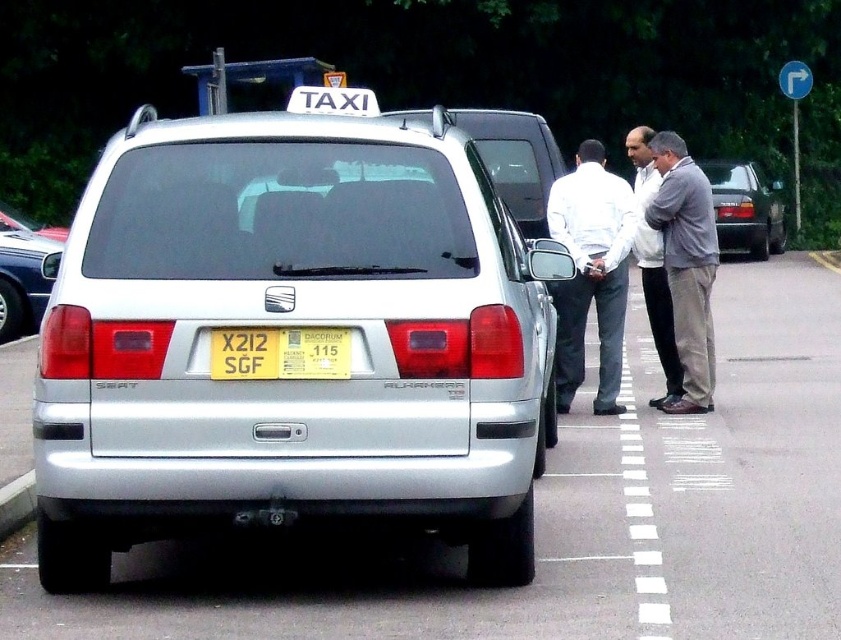
You are a photographer taking a photo of two men in shirts. You notice the white smooth shirt at center and the light gray shirt at center. Which shirt should you focus on to capture more details due to its size?

The white smooth shirt at center is larger in width than the light gray shirt at center, so focusing on the white smooth shirt at center would allow you to capture more details due to its size.

You are a delivery person who needs to hand over a package to the person wearing the gray suit at center. The package is currently on the yellow paper at center. Can you reach the package without moving more than 5 meters from your current position?

The gray suit at center and yellow paper at center are 4.99 meters apart from each other. Since the distance is less than 5 meters, you can reach the package on the yellow paper at center without moving more than 5 meters from your current position.

From the picture: You are a delivery person trying to deliver a package to the silver metallic suv at center. However, there is a light gray shirt at center blocking the way. Can you reach the suv without moving the shirt?

The silver metallic suv at center is positioned under the light gray shirt at center, meaning the shirt is blocking the path. Since the shirt is part of a person standing there, you would need to ask the person to move to access the suv.